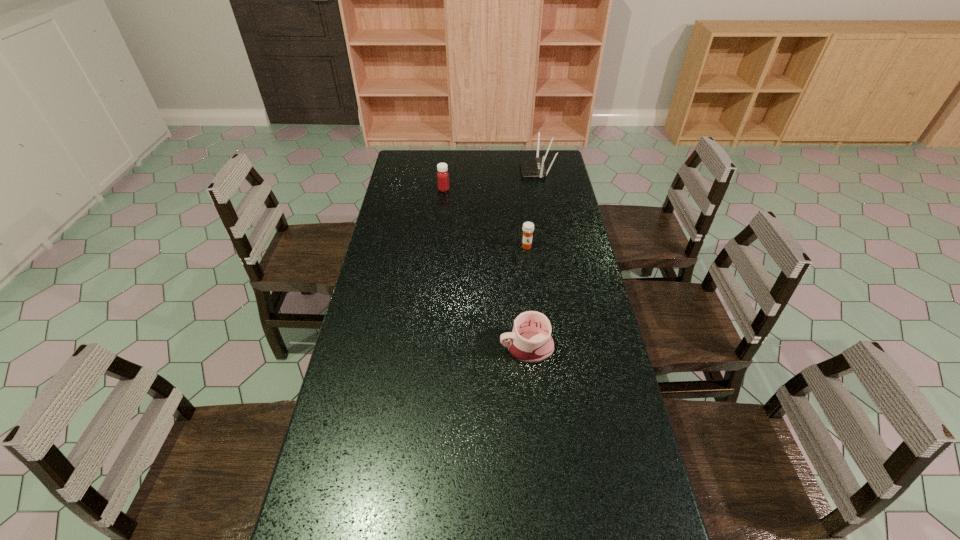
Find the location of `router`. router is located at coordinates (530, 167).

Locate an element on the screen. Image resolution: width=960 pixels, height=540 pixels. the second farthest object is located at coordinates (442, 175).

What are the coordinates of `the farther medicine` in the screenshot? It's located at (442, 175).

At what (x,y) coordinates should I click in order to perform the action: click on the right medicine. Please return your answer as a coordinate pair (x, y). Looking at the image, I should click on (528, 227).

Locate an element on the screen. the shorter medicine is located at coordinates (528, 227).

I want to click on the nearest object, so click(530, 341).

Find the location of a particular element. The height and width of the screenshot is (540, 960). blank space located on the front-facing side of the farthest object is located at coordinates click(x=475, y=170).

This screenshot has height=540, width=960. Find the location of `vacant area situated on the front-facing side of the farthest object`. vacant area situated on the front-facing side of the farthest object is located at coordinates (438, 170).

I want to click on vacant position located 0.090m on the front-facing side of the farthest object, so click(x=501, y=170).

This screenshot has height=540, width=960. I want to click on free space located on the front of the left medicine, so [439, 241].